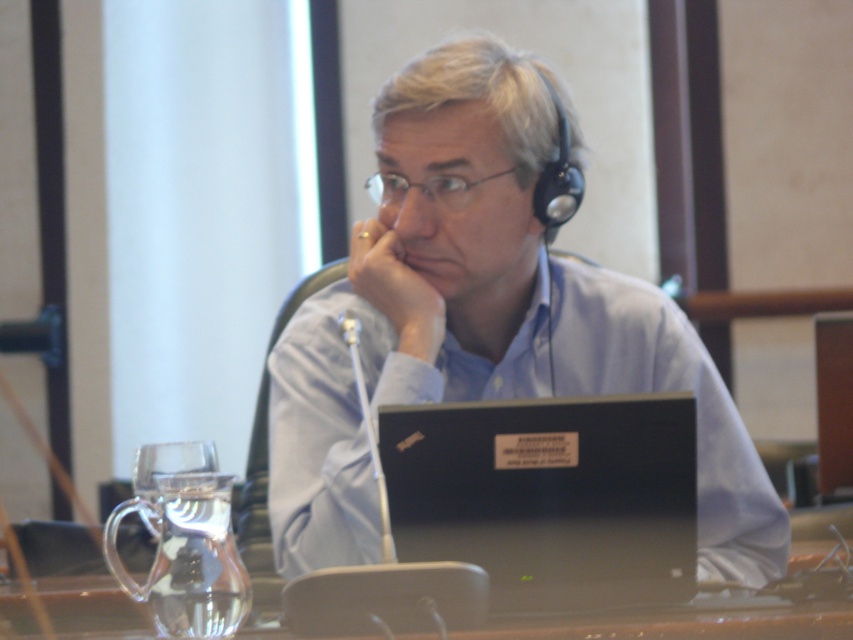
Question: Is matte blue shirt at center wider than black matte laptop at center?

Choices:
 (A) no
 (B) yes

Answer: (B)

Question: Which object is positioned closest to the skinny white jaw at center?

Choices:
 (A) transparent glass table at center
 (B) matte blue shirt at center
 (C) black matte laptop at center

Answer: (B)

Question: Which of the following is the farthest from the observer?

Choices:
 (A) 114,556
 (B) 79,625
 (C) 598,385
 (D) 454,269

Answer: (C)

Question: Observing the image, what is the correct spatial positioning of matte blue shirt at center in reference to skinny white jaw at center?

Choices:
 (A) above
 (B) below

Answer: (B)

Question: From the image, what is the correct spatial relationship of matte blue shirt at center in relation to black matte laptop at center?

Choices:
 (A) right
 (B) left

Answer: (B)

Question: Which point appears closest to the camera in this image?

Choices:
 (A) (155, 508)
 (B) (692, 506)

Answer: (A)